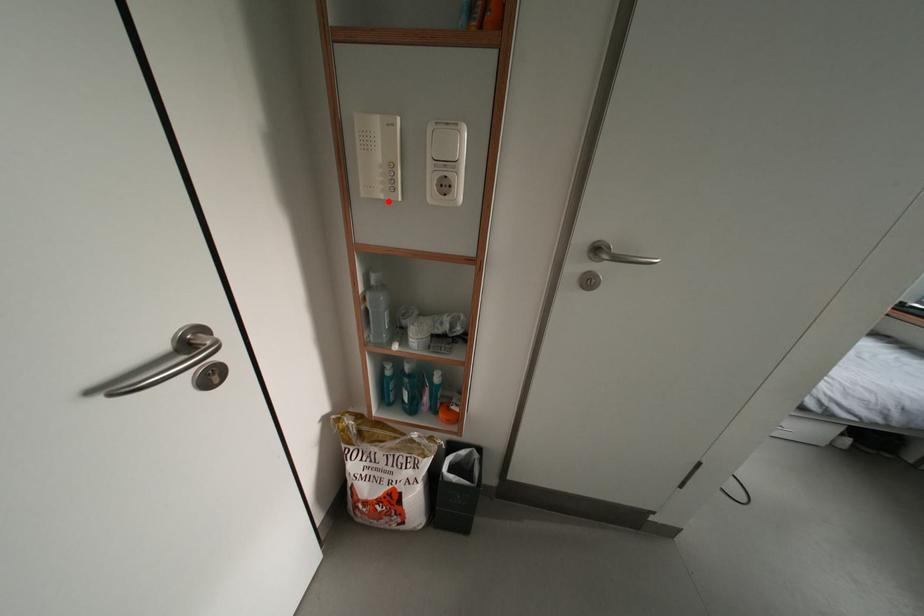
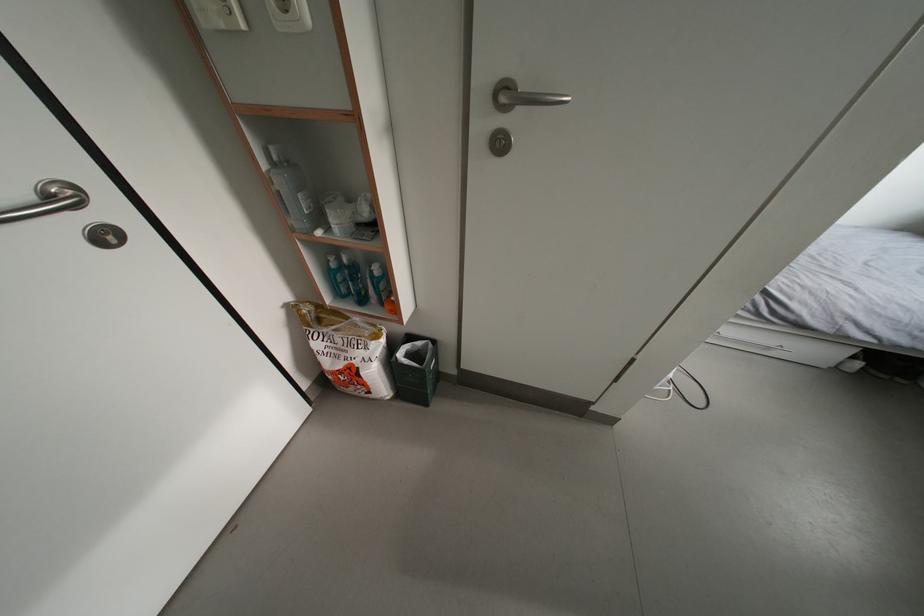
Question: I am providing you with two images of the same scene from different viewpoints. A red point is marked on the first image. Is the red point's position out of view in image 2?

Choices:
 (A) Yes
 (B) No

Answer: (B)